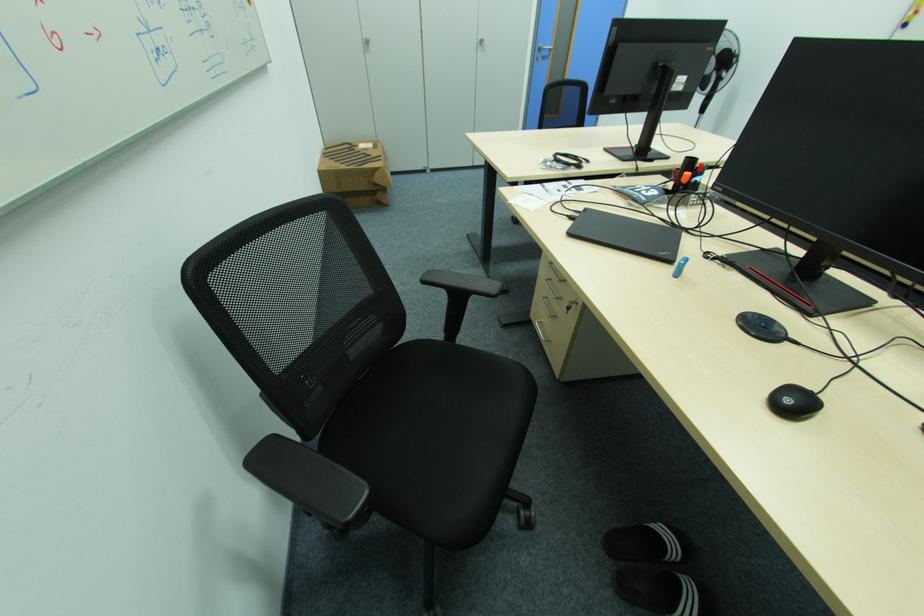
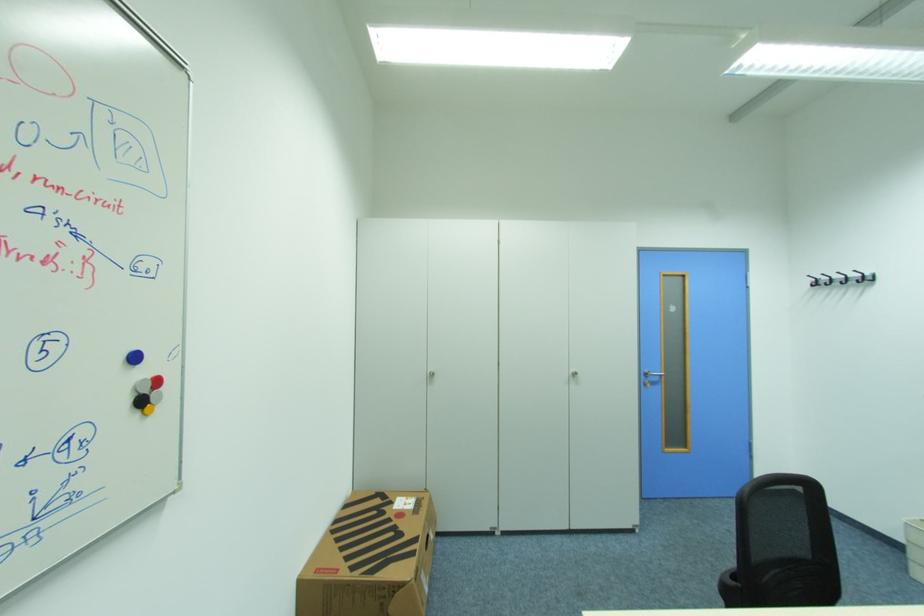
In the second image, find the point that corresponds to the point at 361,147 in the first image.

(396, 503)